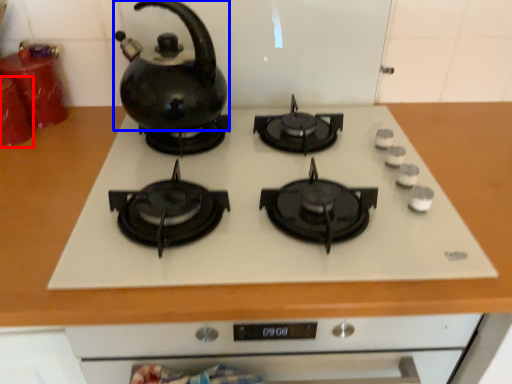
Question: Which object is further to the camera taking this photo, kitchen appliance (highlighted by a red box) or kettle (highlighted by a blue box)?

Choices:
 (A) kitchen appliance
 (B) kettle

Answer: (A)